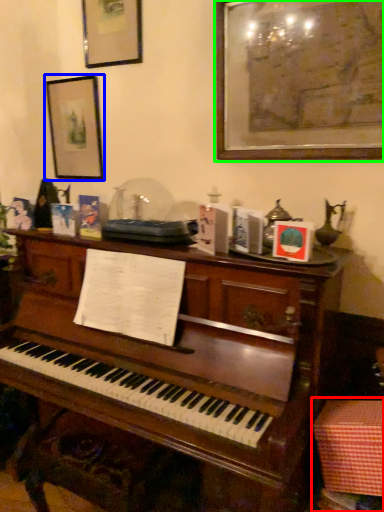
Question: Which object is the closest to the table (highlighted by a red box)? Choose among these: picture frame (highlighted by a blue box) or picture frame (highlighted by a green box).

Choices:
 (A) picture frame
 (B) picture frame

Answer: (B)